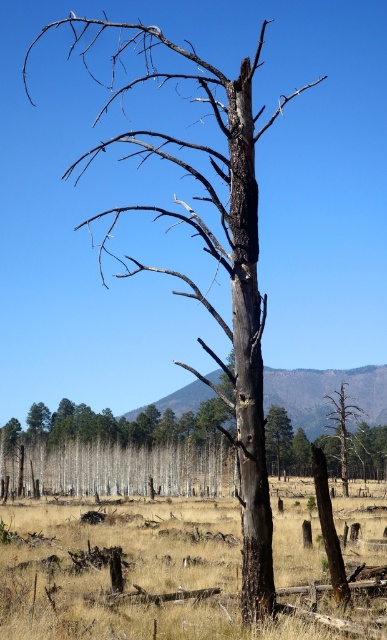
Question: Is dry grass at center thinner than charred wood tree at center?

Choices:
 (A) no
 (B) yes

Answer: (A)

Question: Which object is closer to the camera taking this photo?

Choices:
 (A) dry grass at center
 (B) charred wood tree at center

Answer: (A)

Question: Estimate the real-world distances between objects in this image. Which object is farther from the charred bark tree at center?

Choices:
 (A) charred wood tree at center
 (B) dry grass at center

Answer: (B)

Question: Does dry grass at center lie in front of charred bark tree at center?

Choices:
 (A) no
 (B) yes

Answer: (B)

Question: In this image, where is dry grass at center located relative to charred wood tree at center?

Choices:
 (A) right
 (B) left

Answer: (B)

Question: Which of the following is the closest to the observer?

Choices:
 (A) dry grass at center
 (B) charred bark tree at center

Answer: (A)